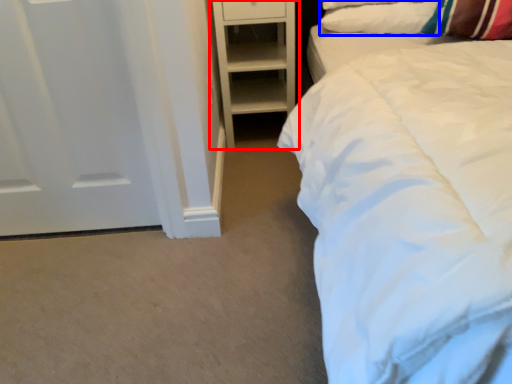
Question: Which object is further to the camera taking this photo, shelf (highlighted by a red box) or pillow (highlighted by a blue box)?

Choices:
 (A) shelf
 (B) pillow

Answer: (A)